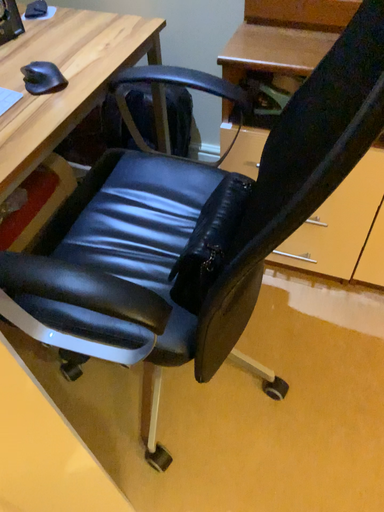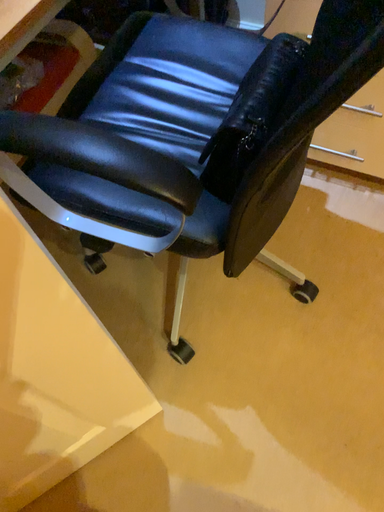
Question: How did the camera likely rotate when shooting the video?

Choices:
 (A) rotated downward
 (B) rotated upward

Answer: (A)